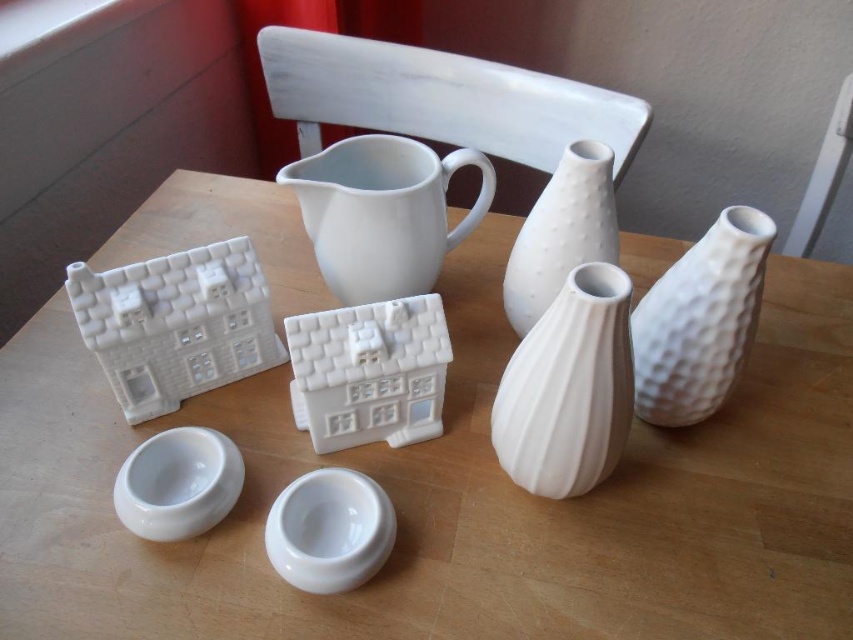
This screenshot has height=640, width=853. What do you see at coordinates (567, 388) in the screenshot?
I see `white textured vase at center` at bounding box center [567, 388].

What do you see at coordinates (567, 388) in the screenshot? I see `white textured vase at center` at bounding box center [567, 388].

At what (x,y) coordinates should I click in order to perform the action: click on white textured vase at center. Please return your answer as a coordinate pair (x, y). Image resolution: width=853 pixels, height=640 pixels. Looking at the image, I should click on (567, 388).

Is white textured vase at right thinner than white glossy bowl at lower left?

In fact, white textured vase at right might be wider than white glossy bowl at lower left.

Who is higher up, white textured vase at right or white glossy bowl at lower left?

white textured vase at right

The height and width of the screenshot is (640, 853). What do you see at coordinates (700, 321) in the screenshot?
I see `white textured vase at right` at bounding box center [700, 321].

This screenshot has width=853, height=640. I want to click on white textured vase at right, so click(700, 321).

Does white textured vase at center have a lesser height compared to white glossy bowl at lower center?

In fact, white textured vase at center may be taller than white glossy bowl at lower center.

Between white textured vase at center and white glossy bowl at lower center, which one has less height?

Standing shorter between the two is white glossy bowl at lower center.

Image resolution: width=853 pixels, height=640 pixels. I want to click on white textured vase at center, so click(567, 388).

Where is `white textured vase at center`? white textured vase at center is located at coordinates (567, 388).